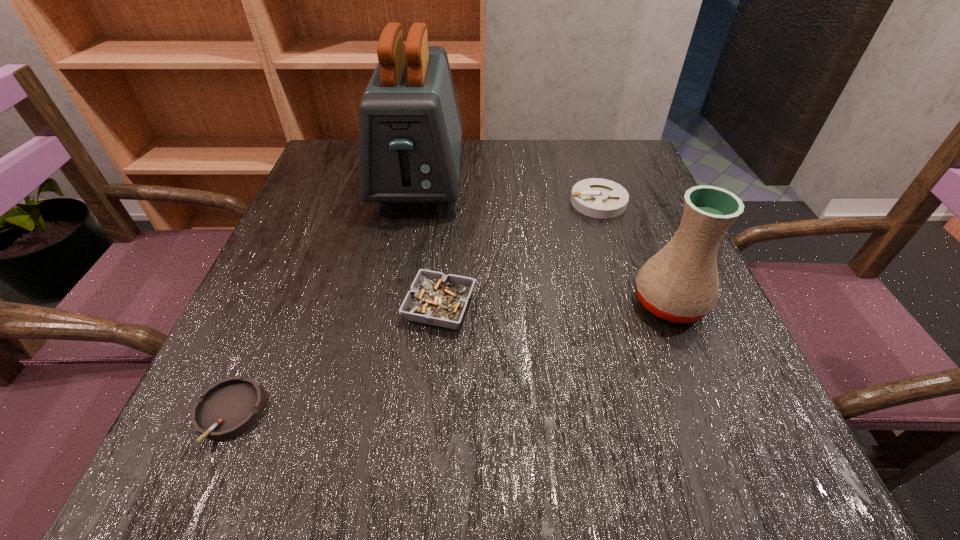
The height and width of the screenshot is (540, 960). Identify the location of the closest ashtray relative to the second tallest object. (599, 198).

Locate an element on the screen. The width and height of the screenshot is (960, 540). blank space that satisfies the following two spatial constraints: 1. on the front-facing side of the tallest object; 2. on the left side of the second nearest ashtray is located at coordinates (396, 307).

I want to click on blank space that satisfies the following two spatial constraints: 1. on the front-facing side of the farthest ashtray; 2. on the right side of the toaster, so click(x=414, y=202).

Where is `vacant space that satisfies the following two spatial constraints: 1. on the front-facing side of the toaster; 2. on the left side of the fourth shortest object`? The height and width of the screenshot is (540, 960). vacant space that satisfies the following two spatial constraints: 1. on the front-facing side of the toaster; 2. on the left side of the fourth shortest object is located at coordinates (396, 302).

Where is `free spot that satisfies the following two spatial constraints: 1. on the back side of the leftmost object; 2. on the right side of the second ashtray from left to right`? The height and width of the screenshot is (540, 960). free spot that satisfies the following two spatial constraints: 1. on the back side of the leftmost object; 2. on the right side of the second ashtray from left to right is located at coordinates (276, 307).

Find the location of a particular element. vacant space that satisfies the following two spatial constraints: 1. on the front-facing side of the second ashtray from right to left; 2. on the right side of the toaster is located at coordinates (396, 307).